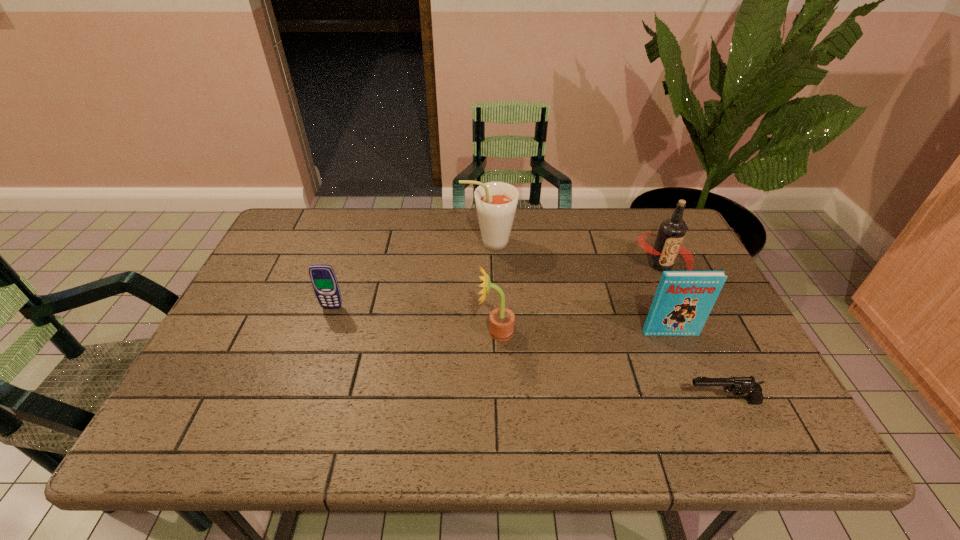
Identify the location of free point at the near right corner. (806, 447).

Image resolution: width=960 pixels, height=540 pixels. In order to click on unoccupied area between the left root beer and the right root beer in this screenshot , I will do `click(575, 254)`.

Identify the location of vacant space in between the left root beer and the second shortest object. The width and height of the screenshot is (960, 540). (411, 275).

The image size is (960, 540). In order to click on vacant point located between the nearest object and the left root beer in this screenshot , I will do `click(606, 322)`.

Identify the location of free spot between the book and the nearest object. (696, 367).

Find the location of a particular element. The width and height of the screenshot is (960, 540). empty location between the book and the sunflower is located at coordinates (583, 333).

Locate an element on the screen. Image resolution: width=960 pixels, height=540 pixels. object that is the fifth nearest to the right root beer is located at coordinates (323, 278).

You are a GUI agent. You are given a task and a screenshot of the screen. Output one action in this format:
    pyautogui.click(x=<x>, y=<y>)
    Task: Click on the object that is the second closest to the nearest object
    This screenshot has height=540, width=960.
    Given the screenshot: What is the action you would take?
    pyautogui.click(x=668, y=243)

This screenshot has height=540, width=960. I want to click on free point that satisfies the following two spatial constraints: 1. on the drink side of the left root beer; 2. on the front-facing side of the fourth nearest object, so click(x=491, y=308).